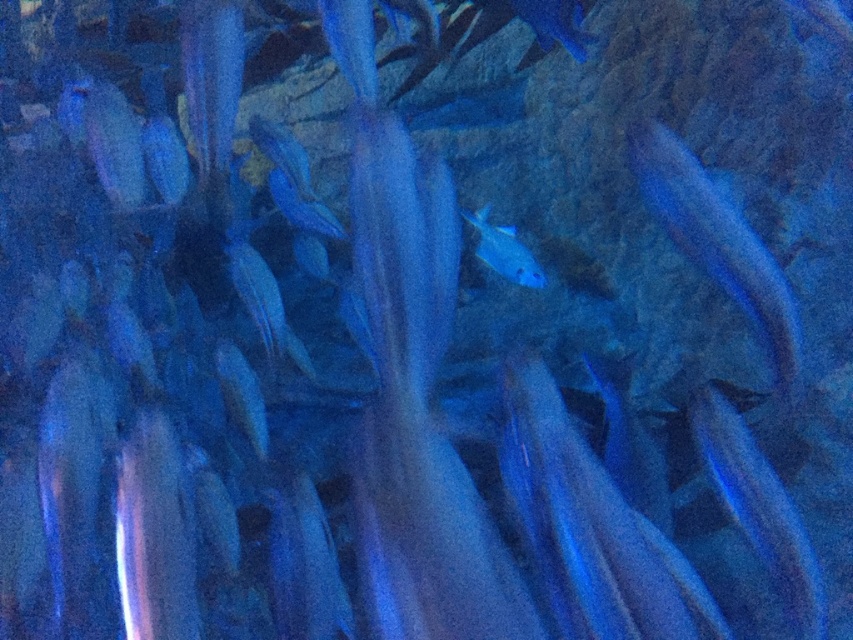
Question: Where is glossy blue fish at right located in relation to glossy blue fish at center in the image?

Choices:
 (A) above
 (B) below

Answer: (B)

Question: Which of the following is the farthest from the observer?

Choices:
 (A) (492, 237)
 (B) (735, 264)

Answer: (A)

Question: Considering the relative positions of glossy blue fish at right and glossy blue fish at center in the image provided, where is glossy blue fish at right located with respect to glossy blue fish at center?

Choices:
 (A) above
 (B) below

Answer: (B)

Question: Which object appears farthest from the camera in this image?

Choices:
 (A) glossy blue fish at center
 (B) glossy blue fish at right

Answer: (A)

Question: Does glossy blue fish at right have a smaller size compared to glossy blue fish at center?

Choices:
 (A) no
 (B) yes

Answer: (A)